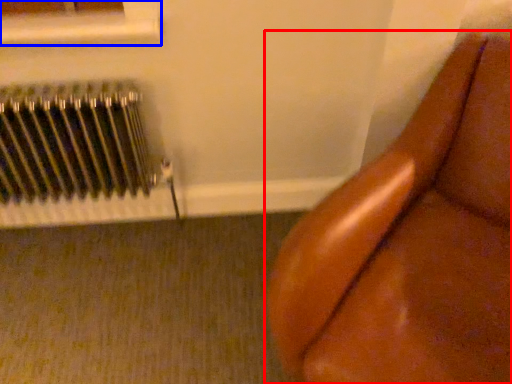
Question: Among these objects, which one is nearest to the camera, furniture (highlighted by a red box) or window frame (highlighted by a blue box)?

Choices:
 (A) furniture
 (B) window frame

Answer: (A)